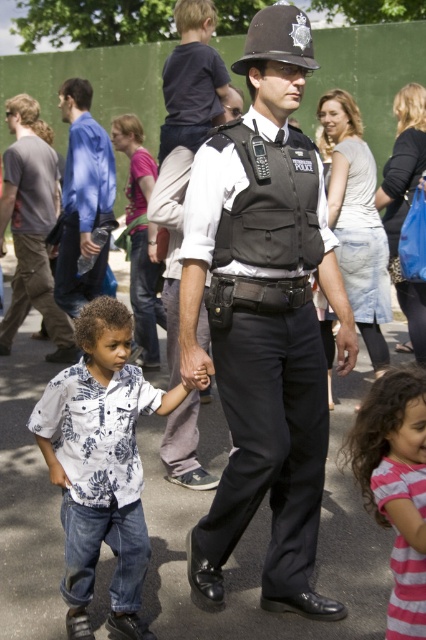
Question: Which object is the farthest from the pink striped dress at lower right?

Choices:
 (A) gray cotton shirt at left
 (B) blue shirt at upper left
 (C) denim skirt at center
 (D) dark blue shirt at upper center

Answer: (A)

Question: Does black uniformed police officer at center appear on the right side of white floral shirt at lower left?

Choices:
 (A) no
 (B) yes

Answer: (B)

Question: Considering the real-world distances, which object is farthest from the pink striped dress at lower right?

Choices:
 (A) white floral shirt at lower left
 (B) dark blue shirt at upper center
 (C) denim skirt at center
 (D) blue shirt at upper left

Answer: (D)

Question: Is white floral shirt at lower left thinner than dark blue shirt at upper center?

Choices:
 (A) yes
 (B) no

Answer: (B)

Question: Does black uniformed police officer at center have a larger size compared to blue shirt at upper left?

Choices:
 (A) no
 (B) yes

Answer: (B)

Question: Based on their relative distances, which object is nearer to the denim skirt at center?

Choices:
 (A) pink striped dress at lower right
 (B) black uniformed police officer at center
 (C) blue shirt at upper left

Answer: (B)